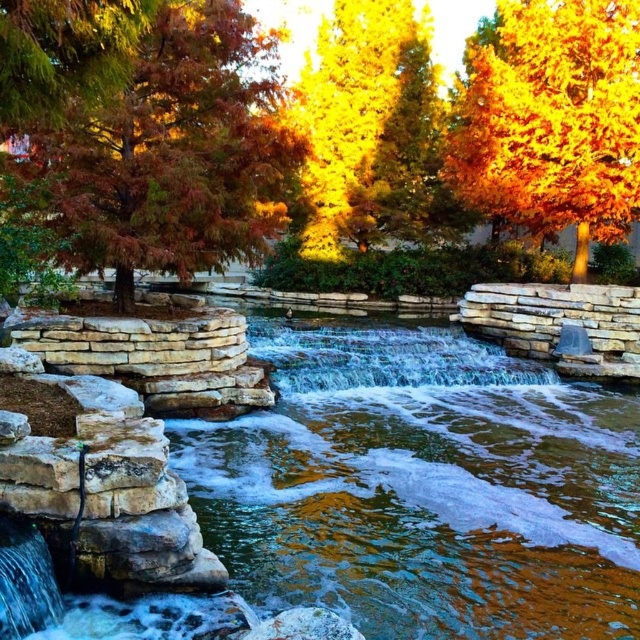
Is golden yellow leaves at upper right shorter than golden yellow leaves at upper center?

Correct, golden yellow leaves at upper right is not as tall as golden yellow leaves at upper center.

Is golden yellow leaves at upper right smaller than golden yellow leaves at upper center?

Indeed, golden yellow leaves at upper right has a smaller size compared to golden yellow leaves at upper center.

Is point (508, 70) closer to viewer compared to point (316, 192)?

Yes, it is.

Where is `golden yellow leaves at upper right`? The image size is (640, 640). golden yellow leaves at upper right is located at coordinates (554, 120).

Does golden yellow leaves at upper center have a larger size compared to translucent glass waterfall at center?

Yes, golden yellow leaves at upper center is bigger than translucent glass waterfall at center.

Which is more to the left, golden yellow leaves at upper center or translucent glass waterfall at center?

golden yellow leaves at upper center

Identify the location of golden yellow leaves at upper center. (348, 108).

Does golden yellow leaves at upper right have a lesser width compared to translucent glass waterfall at center?

Yes.

Does golden yellow leaves at upper right have a smaller size compared to translucent glass waterfall at center?

Indeed, golden yellow leaves at upper right has a smaller size compared to translucent glass waterfall at center.

This screenshot has height=640, width=640. What do you see at coordinates (554, 120) in the screenshot? I see `golden yellow leaves at upper right` at bounding box center [554, 120].

The width and height of the screenshot is (640, 640). I want to click on golden yellow leaves at upper right, so click(554, 120).